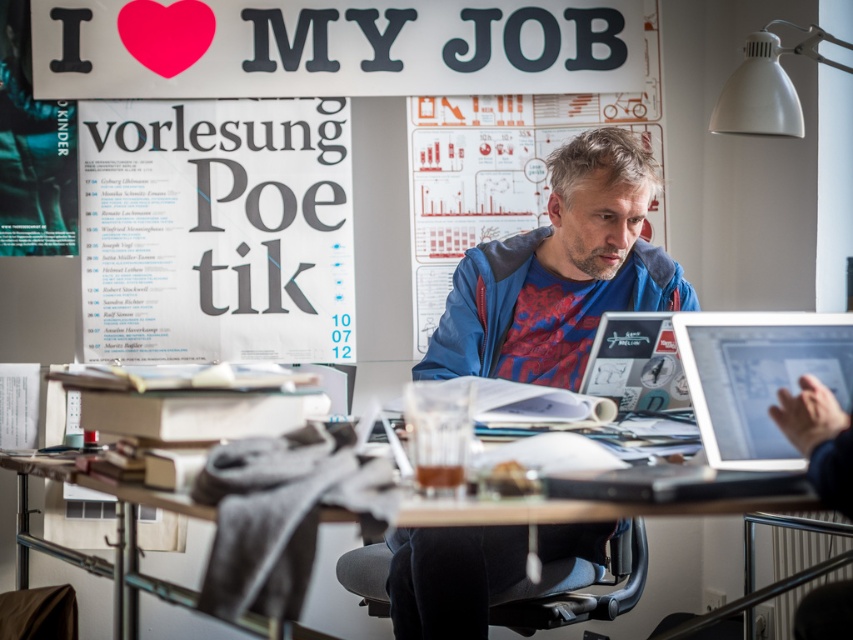
Question: In this image, where is white paper poster at upper left located relative to blue fleece jacket at center?

Choices:
 (A) below
 (B) above

Answer: (B)

Question: Considering the real-world distances, which object is farthest from the matte paper poster at center?

Choices:
 (A) blue fleece jacket at center
 (B) silver metallic laptop at center
 (C) white paper poster at upper left
 (D) white matte lampshade at upper right

Answer: (B)

Question: Among these objects, which one is farthest from the camera?

Choices:
 (A) blue fleece jacket at center
 (B) matte paper poster at center
 (C) matte silver laptop at right
 (D) silver metallic laptop at center

Answer: (B)

Question: Does matte silver laptop at right have a lesser width compared to white matte lampshade at upper right?

Choices:
 (A) no
 (B) yes

Answer: (B)

Question: From the image, what is the correct spatial relationship of white paper poster at upper left in relation to white matte lampshade at upper right?

Choices:
 (A) right
 (B) left

Answer: (B)

Question: Among these objects, which one is nearest to the camera?

Choices:
 (A) wooden table at center
 (B) white paper poster at upper left
 (C) white matte lampshade at upper right
 (D) blue fleece jacket at center

Answer: (A)